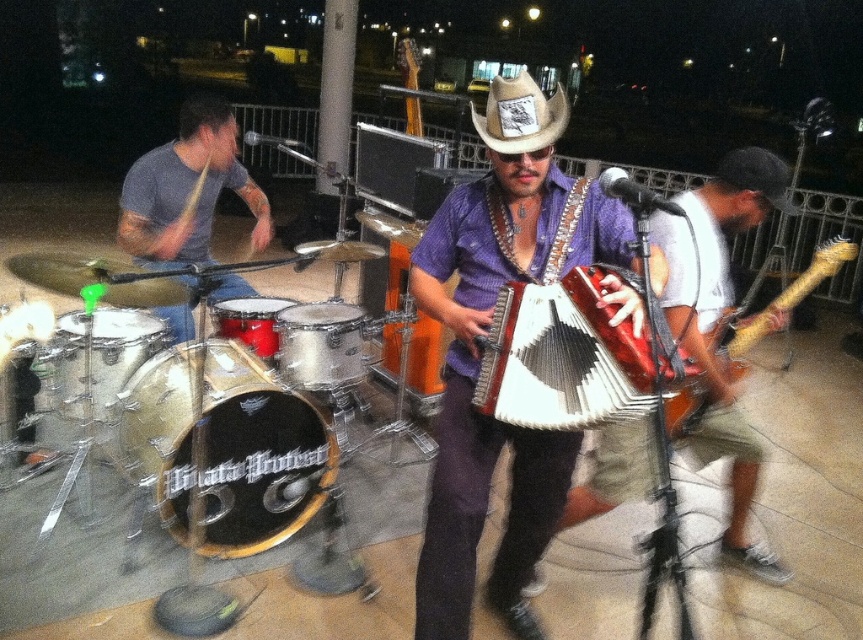
Question: Which of the following is the farthest from the observer?

Choices:
 (A) wooden electric guitar at right
 (B) brown leather cowboy hat at center
 (C) matte purple shirt at center

Answer: (B)

Question: In this image, where is matte purple shirt at center located relative to brushed metal drum at left?

Choices:
 (A) right
 (B) left

Answer: (A)

Question: Among these objects, which one is nearest to the camera?

Choices:
 (A) brushed metal drum set at left
 (B) white matte accordion at center
 (C) matte purple shirt at center

Answer: (B)

Question: Can you confirm if white matte accordion at center is positioned below tan woven cowboy hat at center?

Choices:
 (A) yes
 (B) no

Answer: (A)

Question: Is tan woven cowboy hat at center positioned before red drum at center?

Choices:
 (A) yes
 (B) no

Answer: (A)

Question: Which of these objects is positioned closest to the brushed metal drum set at left?

Choices:
 (A) wooden electric guitar at right
 (B) brown leather cowboy hat at center
 (C) red drum at center

Answer: (C)